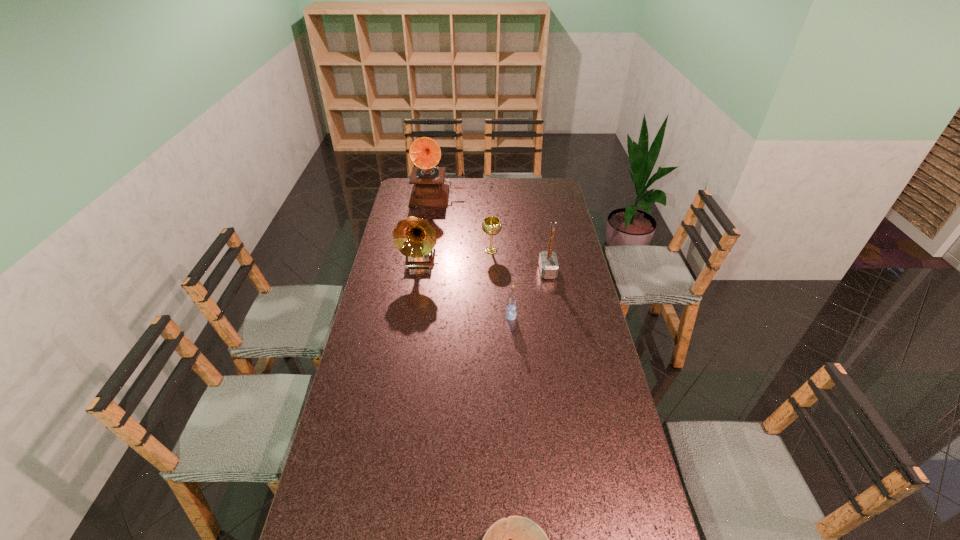
Where is `free location located on the striking surface of the rightmost object`? This screenshot has width=960, height=540. free location located on the striking surface of the rightmost object is located at coordinates (454, 272).

Where is `vacant point located on the right of the chalice`? vacant point located on the right of the chalice is located at coordinates (517, 251).

Identify the location of blank space located 0.060m on the front of the second nearest object. (513, 333).

Locate an element on the screen. This screenshot has height=540, width=960. object that is at the far edge is located at coordinates (429, 190).

You are a GUI agent. You are given a task and a screenshot of the screen. Output one action in this format:
    pyautogui.click(x=<x>, y=<y>)
    Task: Click on the object situated at the right edge
    The height and width of the screenshot is (540, 960).
    Given the screenshot: What is the action you would take?
    pyautogui.click(x=548, y=263)

Where is `object present at the far left corner`? This screenshot has height=540, width=960. object present at the far left corner is located at coordinates (429, 190).

This screenshot has height=540, width=960. In the image, there is a desktop. In order to click on blank space at the far edge in this screenshot , I will do `click(506, 190)`.

In the image, there is a desktop. Where is `vacant space at the left edge`? The width and height of the screenshot is (960, 540). vacant space at the left edge is located at coordinates (382, 265).

This screenshot has height=540, width=960. In the image, there is a desktop. Find the location of `vacant area at the right edge`. vacant area at the right edge is located at coordinates (612, 441).

Image resolution: width=960 pixels, height=540 pixels. In order to click on vacant region between the shorter phonograph_record and the rightmost object in this screenshot , I will do `click(484, 266)`.